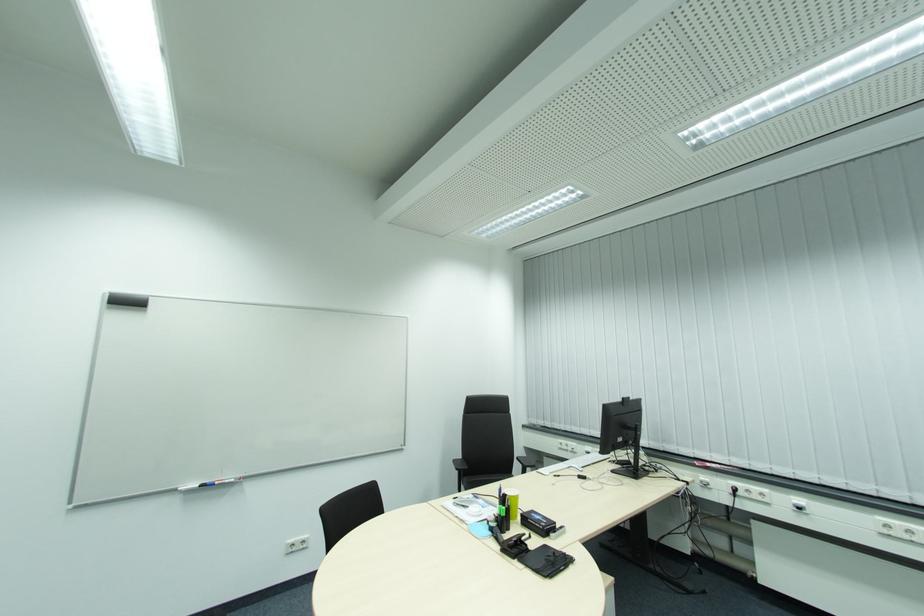
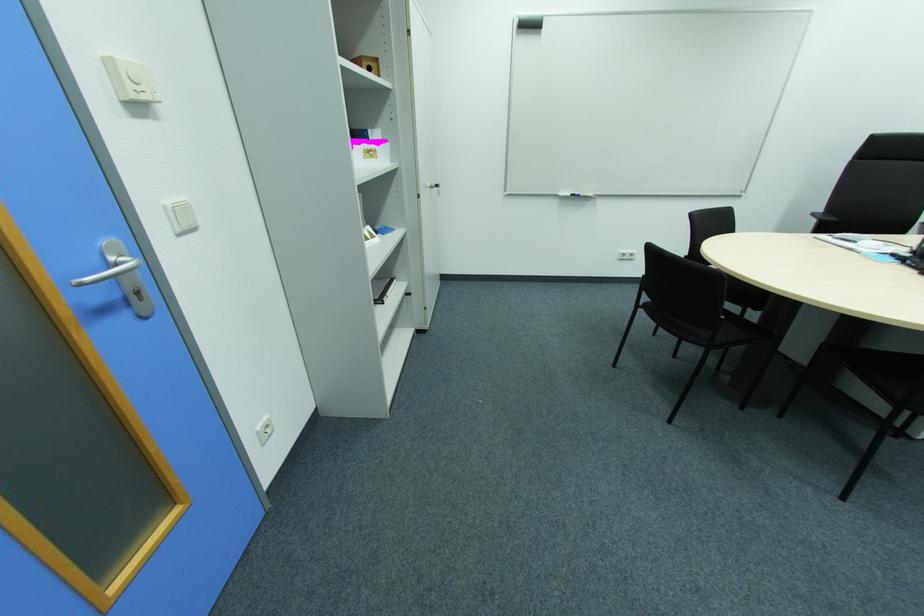
Question: I am providing you with two images of the same scene from different viewpoints. After the viewpoint changes to image2, which objects are now occluded?

Choices:
 (A) metal door handle
 (B) black book
 (C) black whiteboard marker
 (D) none of these

Answer: (D)